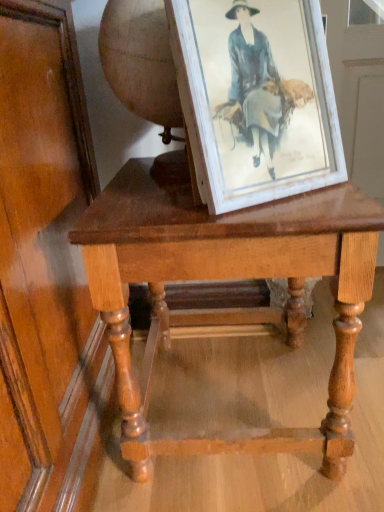
Locate an element on the screen. Image resolution: width=384 pixels, height=512 pixels. light brown wooden table at center is located at coordinates (229, 279).

What do you see at coordinates (229, 279) in the screenshot? I see `light brown wooden table at center` at bounding box center [229, 279].

In order to face light brown wooden table at center, should I rotate leftwards or rightwards?

You should look right and rotate roughly 4.306 degrees.

Where is `white distressed wood picture frame at center`? The width and height of the screenshot is (384, 512). white distressed wood picture frame at center is located at coordinates (256, 99).

This screenshot has height=512, width=384. What do you see at coordinates (256, 99) in the screenshot?
I see `white distressed wood picture frame at center` at bounding box center [256, 99].

The image size is (384, 512). Identify the location of light brown wooden table at center. (229, 279).

Which object is positioned more to the left, light brown wooden table at center or white distressed wood picture frame at center?

From the viewer's perspective, light brown wooden table at center appears more on the left side.

Is light brown wooden table at center further to the viewer compared to white distressed wood picture frame at center?

Yes, the depth of light brown wooden table at center is greater than that of white distressed wood picture frame at center.

Does point (137, 223) come closer to viewer compared to point (239, 24)?

Yes.

From the image's perspective, is light brown wooden table at center above white distressed wood picture frame at center?

Incorrect, from the image's perspective, light brown wooden table at center is lower than white distressed wood picture frame at center.

From a real-world perspective, between light brown wooden table at center and white distressed wood picture frame at center, who is vertically higher?

From a 3D spatial view, white distressed wood picture frame at center is above.

Considering the sizes of light brown wooden table at center and white distressed wood picture frame at center in the image, is light brown wooden table at center wider or thinner than white distressed wood picture frame at center?

In the image, light brown wooden table at center appears to be wider than white distressed wood picture frame at center.

Is light brown wooden table at center taller or shorter than white distressed wood picture frame at center?

Considering their sizes, light brown wooden table at center has more height than white distressed wood picture frame at center.

Can you confirm if light brown wooden table at center is bigger than white distressed wood picture frame at center?

Yes, light brown wooden table at center is bigger than white distressed wood picture frame at center.

Consider the image. Is light brown wooden table at center surrounding white distressed wood picture frame at center?

No, white distressed wood picture frame at center is not a part of light brown wooden table at center.

Is there a large distance between light brown wooden table at center and white distressed wood picture frame at center?

No.

Is white distressed wood picture frame at center at the back of light brown wooden table at center?

light brown wooden table at center is not turned away from white distressed wood picture frame at center.

How many degrees apart are the facing directions of light brown wooden table at center and white distressed wood picture frame at center?

There is a 29.9-degree angle between the facing directions of light brown wooden table at center and white distressed wood picture frame at center.

The height and width of the screenshot is (512, 384). I want to click on picture frame above the light brown wooden table at center (from a real-world perspective), so click(256, 99).

From the picture: Can you confirm if white distressed wood picture frame at center is positioned to the right of light brown wooden table at center?

Correct, you'll find white distressed wood picture frame at center to the right of light brown wooden table at center.

Is the depth of white distressed wood picture frame at center less than that of light brown wooden table at center?

Yes, white distressed wood picture frame at center is closer to the camera.

Is point (214, 105) behind point (136, 409)?

No, it is not.

From the image's perspective, which one is positioned higher, white distressed wood picture frame at center or light brown wooden table at center?

From the image's view, white distressed wood picture frame at center is above.

From a real-world perspective, between white distressed wood picture frame at center and light brown wooden table at center, who is vertically higher?

white distressed wood picture frame at center, from a real-world perspective.

Considering the sizes of objects white distressed wood picture frame at center and light brown wooden table at center in the image provided, who is wider, white distressed wood picture frame at center or light brown wooden table at center?

light brown wooden table at center is wider.

Is white distressed wood picture frame at center taller than light brown wooden table at center?

In fact, white distressed wood picture frame at center may be shorter than light brown wooden table at center.

Is white distressed wood picture frame at center smaller than light brown wooden table at center?

Yes, white distressed wood picture frame at center is smaller than light brown wooden table at center.

Is light brown wooden table at center inside white distressed wood picture frame at center?

No.

Is white distressed wood picture frame at center not near light brown wooden table at center?

No, white distressed wood picture frame at center is not far from light brown wooden table at center.

Is white distressed wood picture frame at center turned away from light brown wooden table at center?

No, white distressed wood picture frame at center is not facing away from light brown wooden table at center.

What's the angular difference between white distressed wood picture frame at center and light brown wooden table at center's facing directions?

There is a 29.9-degree angle between the facing directions of white distressed wood picture frame at center and light brown wooden table at center.

Could you measure the distance between white distressed wood picture frame at center and light brown wooden table at center?

white distressed wood picture frame at center is 7.46 inches from light brown wooden table at center.

Image resolution: width=384 pixels, height=512 pixels. I want to click on table on the left of white distressed wood picture frame at center, so click(229, 279).

This screenshot has width=384, height=512. Find the location of `picture frame above the light brown wooden table at center (from the image's perspective)`. picture frame above the light brown wooden table at center (from the image's perspective) is located at coordinates (256, 99).

Identify the location of table to the left of white distressed wood picture frame at center. (229, 279).